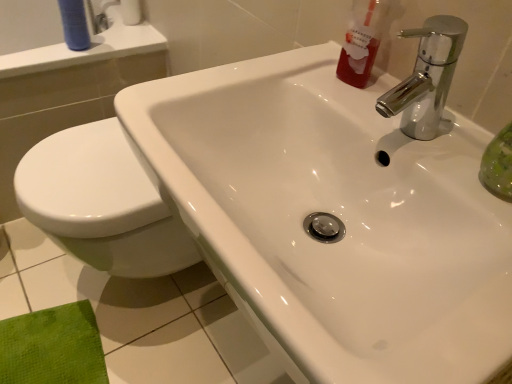
Image resolution: width=512 pixels, height=384 pixels. In order to click on free space in front of chrome metallic faucet at upper right in this screenshot , I will do `click(461, 211)`.